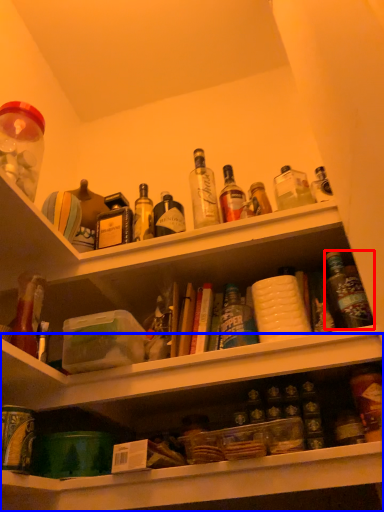
Question: Among these objects, which one is farthest to the camera, bottle (highlighted by a red box) or shelf (highlighted by a blue box)?

Choices:
 (A) bottle
 (B) shelf

Answer: (A)